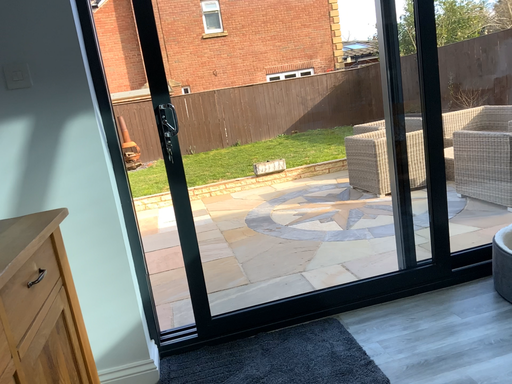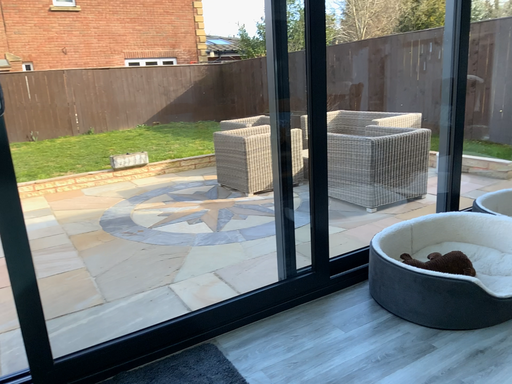
Question: How did the camera likely rotate when shooting the video?

Choices:
 (A) rotated right
 (B) rotated left

Answer: (A)